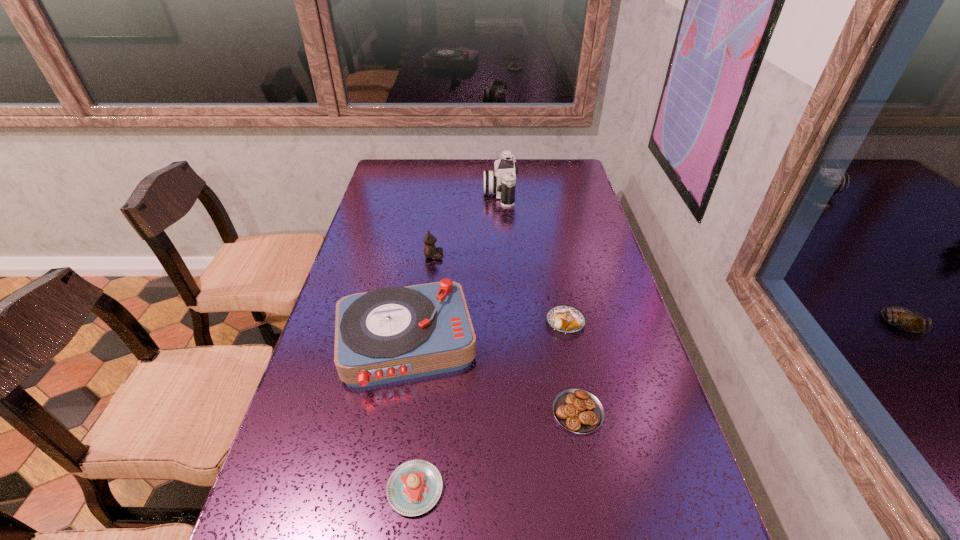
Identify the location of unoccupied area between the record player and the leftmost pastry. (411, 416).

Locate an element on the screen. object that is the fifth closest to the second farthest pastry is located at coordinates (502, 181).

Identify which object is the second closest to the farthest pastry. Please provide its 2D coordinates. Your answer should be formatted as a tuple, i.e. [(x, y)], where the tuple contains the x and y coordinates of a point satisfying the conditions above.

[(390, 334)]

You are a GUI agent. You are given a task and a screenshot of the screen. Output one action in this format:
    pyautogui.click(x=<x>, y=<y>)
    Task: Click on the third closest pastry relative to the second farthest object
    
    Given the screenshot: What is the action you would take?
    pyautogui.click(x=414, y=487)

Locate which pastry ranks in proximity to the fifth nearest object. Please provide its 2D coordinates. Your answer should be formatted as a tuple, i.e. [(x, y)], where the tuple contains the x and y coordinates of a point satisfying the conditions above.

[(565, 319)]

In order to click on vacant space that satisfies the following two spatial constraints: 1. on the face of the teddy bear; 2. on the back side of the farthest pastry in this screenshot , I will do `click(425, 322)`.

Where is `vacant space that satisfies the following two spatial constraints: 1. on the back side of the farthest pastry; 2. on the right side of the second tallest object`? Image resolution: width=960 pixels, height=540 pixels. vacant space that satisfies the following two spatial constraints: 1. on the back side of the farthest pastry; 2. on the right side of the second tallest object is located at coordinates (410, 322).

Find the location of a particular element. The image size is (960, 540). vacant space that satisfies the following two spatial constraints: 1. on the face of the second farthest object; 2. on the right side of the second nearest pastry is located at coordinates (414, 412).

Locate an element on the screen. free spot that satisfies the following two spatial constraints: 1. on the face of the teddy bear; 2. on the back side of the farthest pastry is located at coordinates (425, 322).

Find the location of `free spot that satisfies the following two spatial constraints: 1. on the back side of the farthest pastry; 2. on the face of the teddy bear`. free spot that satisfies the following two spatial constraints: 1. on the back side of the farthest pastry; 2. on the face of the teddy bear is located at coordinates (552, 256).